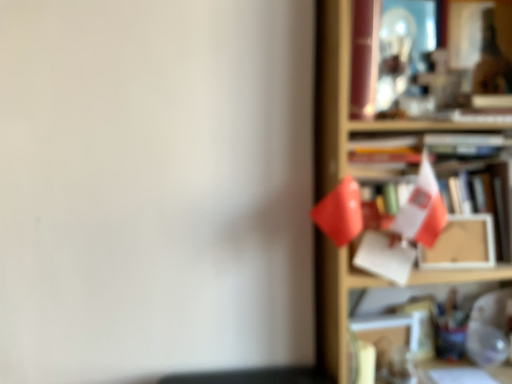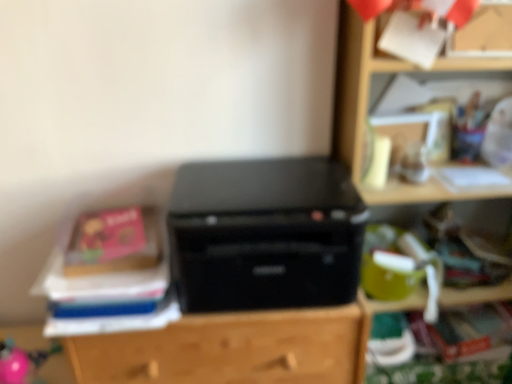
Question: How did the camera likely rotate when shooting the video?

Choices:
 (A) rotated right
 (B) rotated left

Answer: (B)